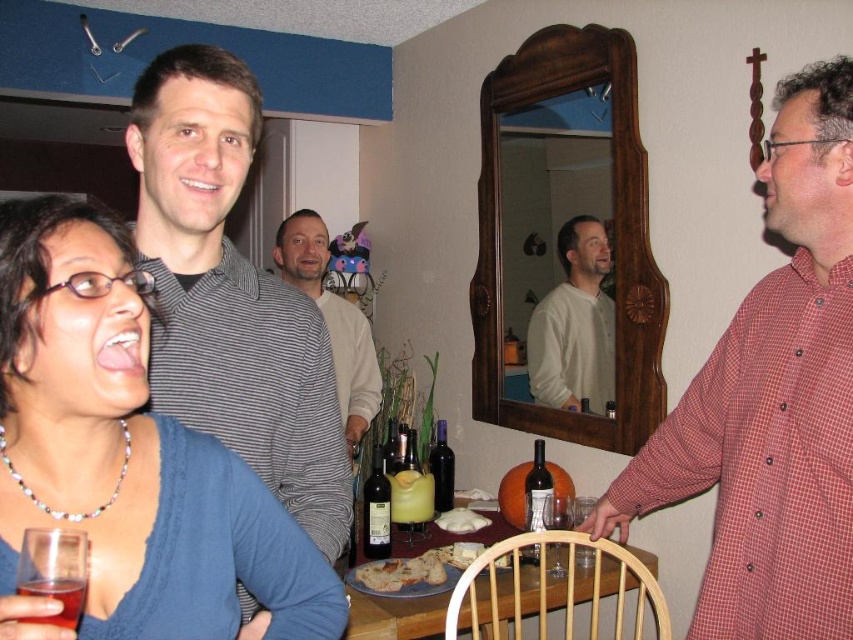
Is point (784, 138) behind point (526, 518)?

That is False.

Who is lower down, red checkered shirt at right or dark glass bottle at table?

dark glass bottle at table is below.

Is point (741, 636) less distant than point (541, 483)?

Yes, point (741, 636) is in front of point (541, 483).

Identify the location of red checkered shirt at right. (773, 401).

Measure the distance between transparent plastic wine glass at lower left and translucent plastic cup at lower left.

transparent plastic wine glass at lower left is 0.39 inches away from translucent plastic cup at lower left.

Is transparent plastic wine glass at lower left bigger than translucent plastic cup at lower left?

No.

Who is more distant from viewer, (38, 532) or (78, 595)?

Point (38, 532)

Identify the location of transparent plastic wine glass at lower left. This screenshot has height=640, width=853. (54, 572).

Can you confirm if golden brown bread at table center is thinner than transparent glass at table right?

No.

Locate an element on the screen. The image size is (853, 640). golden brown bread at table center is located at coordinates (416, 572).